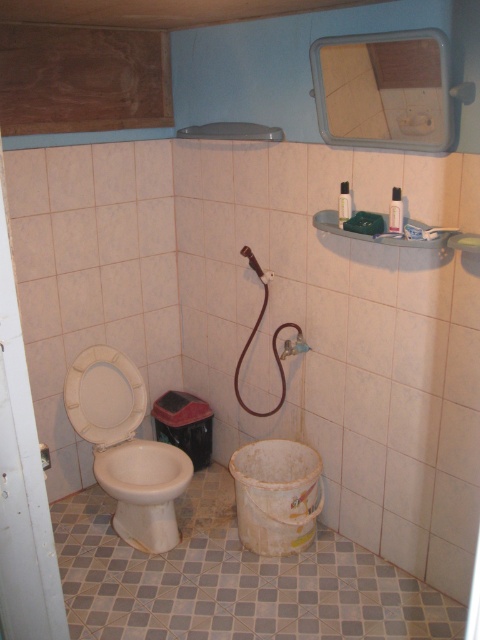
Question: Among these points, which one is nearest to the camera?

Choices:
 (A) (81, 369)
 (B) (116, 456)

Answer: (B)

Question: Can you confirm if white glossy toilet at left is thinner than white glossy toilet bowl at lower left?

Choices:
 (A) no
 (B) yes

Answer: (A)

Question: Among these objects, which one is farthest from the camera?

Choices:
 (A) white glossy toilet at left
 (B) rubber hose at center
 (C) white glossy toilet bowl at lower left

Answer: (B)

Question: From the image, what is the correct spatial relationship of white glossy toilet at left in relation to white glossy toilet bowl at lower left?

Choices:
 (A) above
 (B) below

Answer: (A)

Question: Which object appears farthest from the camera in this image?

Choices:
 (A) white glossy toilet bowl at lower left
 (B) rubber hose at center

Answer: (B)

Question: Is white glossy toilet bowl at lower left thinner than rubber hose at center?

Choices:
 (A) yes
 (B) no

Answer: (B)